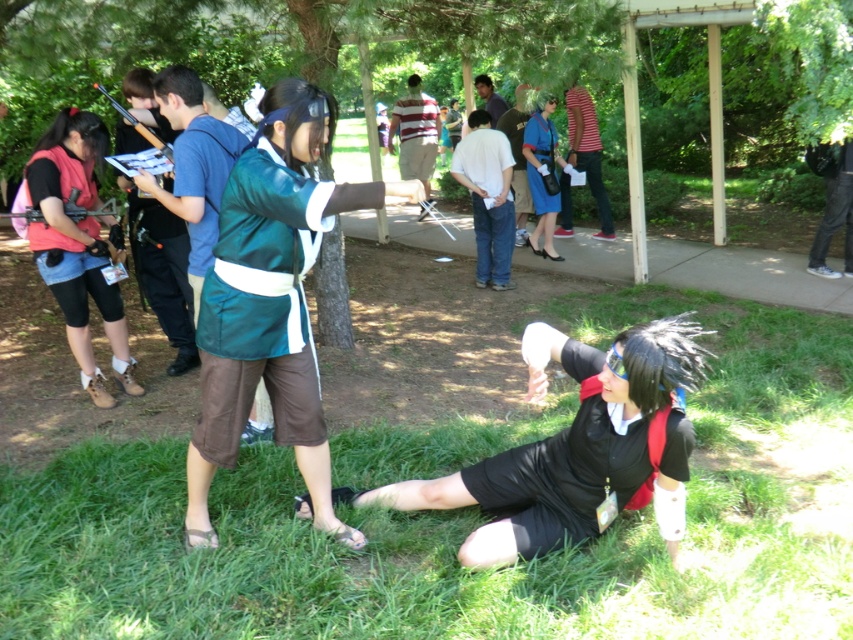
Question: Which object is farther from the camera taking this photo?

Choices:
 (A) matte black vest at left
 (B) white cotton shirt at center

Answer: (B)

Question: Estimate the real-world distances between objects in this image. Which object is closer to the dark blue shirt at center?

Choices:
 (A) denim jeans at center
 (B) green grass at lower center
 (C) blue fabric shirt at upper center
 (D) green satin kimono at center

Answer: (A)

Question: Based on their relative distances, which object is farther from the matte black vest at left?

Choices:
 (A) green satin kimono at center
 (B) striped cotton shirt at center

Answer: (B)

Question: Does white cotton shirt at center appear on the right side of matte blue dress at center?

Choices:
 (A) no
 (B) yes

Answer: (A)

Question: Is striped cotton shirt at center wider than dark blue shirt at center?

Choices:
 (A) yes
 (B) no

Answer: (A)

Question: Considering the relative positions of green grass at lower center and green leafy tree at center in the image provided, where is green grass at lower center located with respect to green leafy tree at center?

Choices:
 (A) below
 (B) above

Answer: (A)